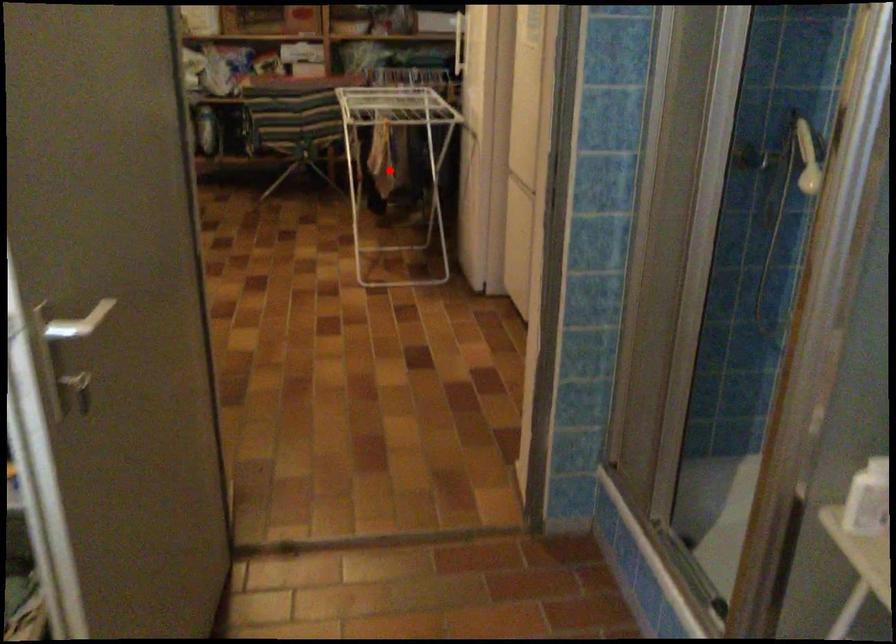
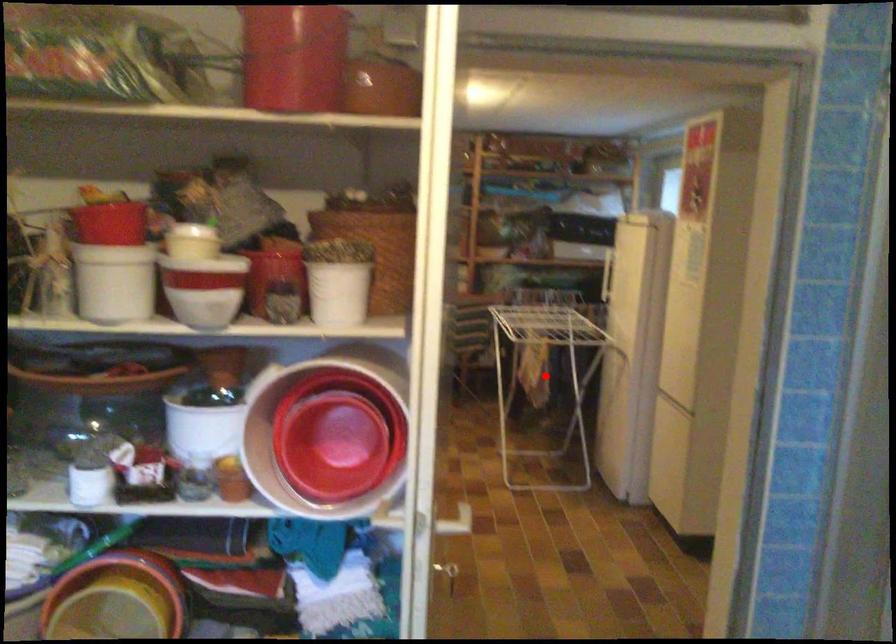
I am providing you with two images of the same scene from different viewpoints. A red point is marked on the first image and another point is marked on the second image. Are the points marked in image1 and image2 representing the same 3D position?

Yes